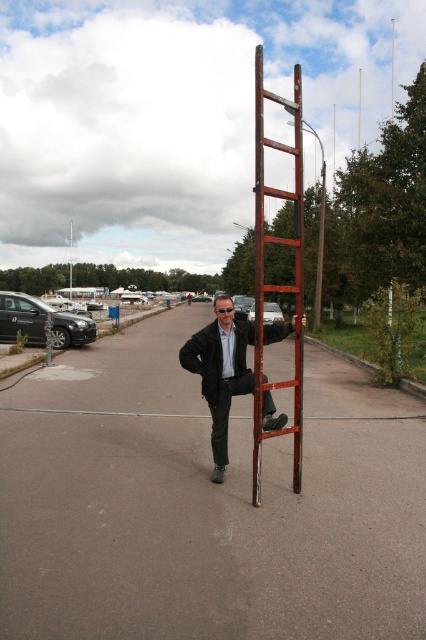
Question: Which point is closer to the camera?

Choices:
 (A) rusty metal ladder at center
 (B) matte black suit at center

Answer: (A)

Question: Can you confirm if metallic gray parking lot at center is smaller than rusty metal ladder at center?

Choices:
 (A) yes
 (B) no

Answer: (A)

Question: Which point is closer to the camera?

Choices:
 (A) rusty metal ladder at center
 (B) metallic gray parking lot at center
 (C) matte black suit at center

Answer: (B)

Question: Which point is closer to the camera taking this photo?

Choices:
 (A) (8, 394)
 (B) (278, 141)
 (C) (241, 376)

Answer: (C)

Question: Can you confirm if metallic gray parking lot at center is bigger than rusty metal ladder at center?

Choices:
 (A) no
 (B) yes

Answer: (A)

Question: Does rusty metal ladder at center lie in front of matte black suit at center?

Choices:
 (A) yes
 (B) no

Answer: (A)